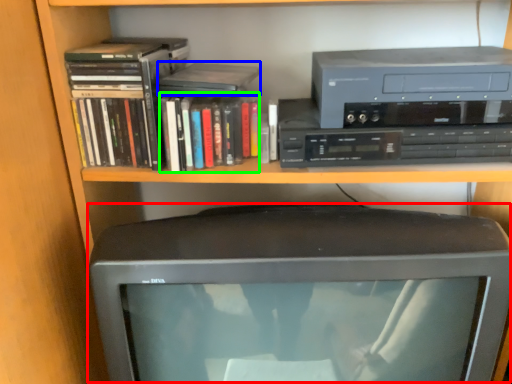
Question: Which is farther away from computer monitor (highlighted by a red box)? paperback book (highlighted by a blue box) or book (highlighted by a green box)?

Choices:
 (A) paperback book
 (B) book

Answer: (A)